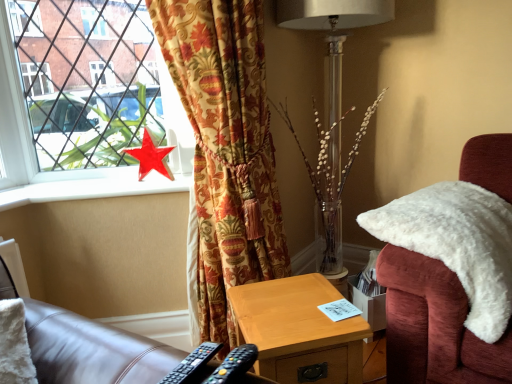
Where is `free location above white smooth window sill at upper left (from a real-world perspective)`? The width and height of the screenshot is (512, 384). free location above white smooth window sill at upper left (from a real-world perspective) is located at coordinates (106, 179).